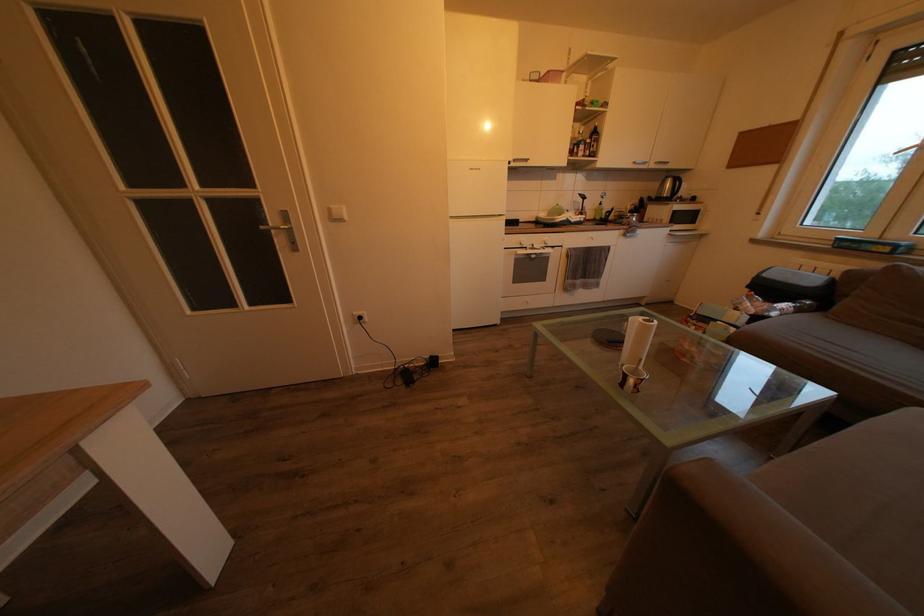
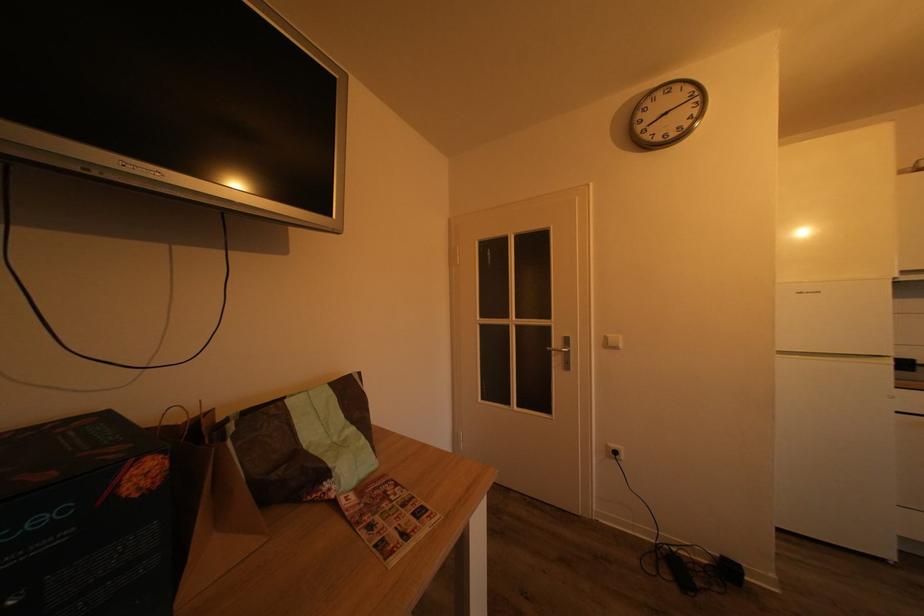
Based on the continuous images, in which direction is the camera rotating?

The rotation direction of the camera is left-up.